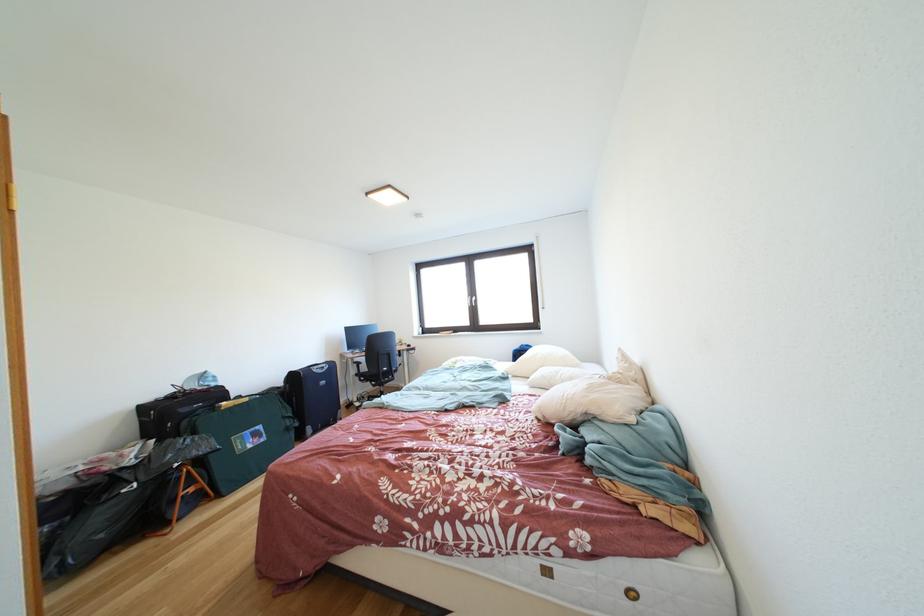
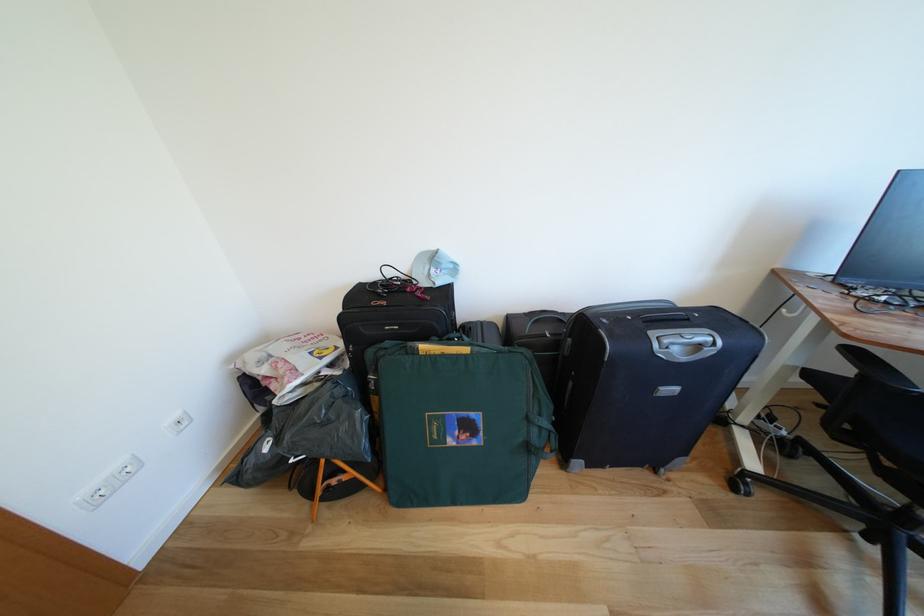
Where in the second image is the point corresponding to [332,371] from the first image?

(707, 351)